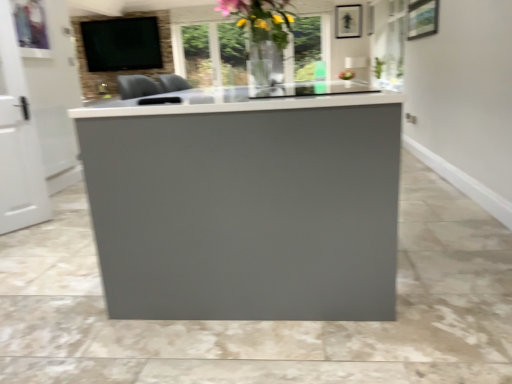
Question: Considering the positions of matte black picture frame at upper center and matte black tv at upper left in the image, is matte black picture frame at upper center wider or thinner than matte black tv at upper left?

Choices:
 (A) thin
 (B) wide

Answer: (A)

Question: Is matte black picture frame at upper center in front of or behind matte black tv at upper left in the image?

Choices:
 (A) behind
 (B) front

Answer: (B)

Question: Estimate the real-world distances between objects in this image. Which object is closer to the white glossy door at left?

Choices:
 (A) translucent glass vase at upper center
 (B) matte black tv at upper left
 (C) green leafy plant at upper right
 (D) matte black picture frame at upper center

Answer: (A)

Question: Which of these objects is positioned farthest from the white glossy door at left?

Choices:
 (A) translucent glass vase at upper center
 (B) green leafy plant at upper right
 (C) matte black tv at upper left
 (D) matte black picture frame at upper center

Answer: (B)